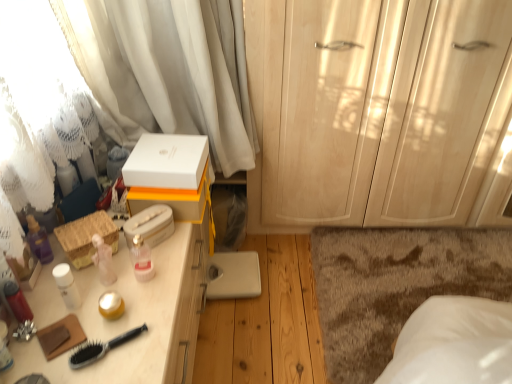
The width and height of the screenshot is (512, 384). Find the location of `vacant area that is in front of pink glossy bottle at center, positioned as the 2th toiletry in left-to-right order`. vacant area that is in front of pink glossy bottle at center, positioned as the 2th toiletry in left-to-right order is located at coordinates (133, 312).